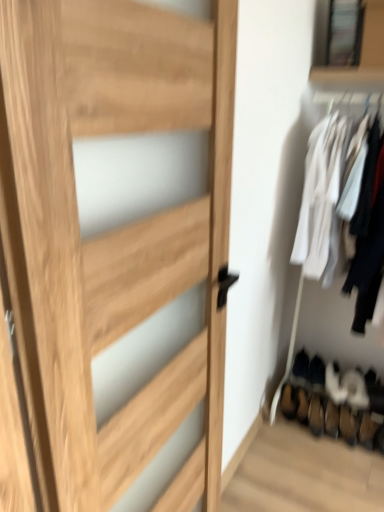
Question: Is white suede shoe at lower right, placed as the fourth shoe when sorted from left to right, thinner than black suede shoe at lower right, which ranks as the 2th shoe in left-to-right order?

Choices:
 (A) yes
 (B) no

Answer: (B)

Question: From a real-world perspective, is white suede shoe at lower right, placed as the fourth shoe when sorted from left to right, physically above black suede shoe at lower right, which ranks as the 2th shoe in left-to-right order?

Choices:
 (A) no
 (B) yes

Answer: (A)

Question: Does white suede shoe at lower right, placed as the second shoe when sorted from right to left, have a lesser height compared to black suede shoe at lower right, which ranks as the 2th shoe in left-to-right order?

Choices:
 (A) no
 (B) yes

Answer: (B)

Question: Is black suede shoe at lower right, marked as the 4th shoe in a right-to-left arrangement, located within white suede shoe at lower right, placed as the fourth shoe when sorted from left to right?

Choices:
 (A) yes
 (B) no

Answer: (B)

Question: Does white suede shoe at lower right, placed as the second shoe when sorted from right to left, lie in front of black suede shoe at lower right, marked as the 4th shoe in a right-to-left arrangement?

Choices:
 (A) yes
 (B) no

Answer: (A)

Question: From the image's perspective, is white suede shoe at lower right, which is counted as the 3th shoe, starting from the left, positioned above or below natural wood door at center?

Choices:
 (A) below
 (B) above

Answer: (A)

Question: Is white suede shoe at lower right, the 3th shoe from the right, wider or thinner than natural wood door at center?

Choices:
 (A) thin
 (B) wide

Answer: (B)

Question: Considering their positions, is white suede shoe at lower right, the 3th shoe from the right, located in front of or behind natural wood door at center?

Choices:
 (A) front
 (B) behind

Answer: (B)

Question: From their relative heights in the image, would you say white suede shoe at lower right, which is counted as the 3th shoe, starting from the left, is taller or shorter than natural wood door at center?

Choices:
 (A) tall
 (B) short

Answer: (B)

Question: Do you think white suede shoe at lower right, placed as the fourth shoe when sorted from left to right, is within brown suede shoe at lower right, the first shoe positioned from the left, or outside of it?

Choices:
 (A) outside
 (B) inside

Answer: (A)

Question: Looking at the image, does white suede shoe at lower right, placed as the second shoe when sorted from right to left, seem bigger or smaller compared to brown suede shoe at lower right, which ranks as the fifth shoe in right-to-left order?

Choices:
 (A) big
 (B) small

Answer: (A)

Question: Based on their positions, is white suede shoe at lower right, placed as the fourth shoe when sorted from left to right, located to the left or right of brown suede shoe at lower right, which ranks as the fifth shoe in right-to-left order?

Choices:
 (A) left
 (B) right

Answer: (B)

Question: Is white suede shoe at lower right, placed as the fourth shoe when sorted from left to right, in front of or behind brown suede shoe at lower right, the first shoe positioned from the left, in the image?

Choices:
 (A) behind
 (B) front

Answer: (B)

Question: From a real-world perspective, is brown suede shoe at lower right, the first shoe positioned from the left, above or below white suede shoe at lower right, the 1th shoe positioned from the right?

Choices:
 (A) below
 (B) above

Answer: (B)

Question: Based on their positions, is brown suede shoe at lower right, which ranks as the fifth shoe in right-to-left order, located to the left or right of white suede shoe at lower right, the 1th shoe positioned from the right?

Choices:
 (A) left
 (B) right

Answer: (A)